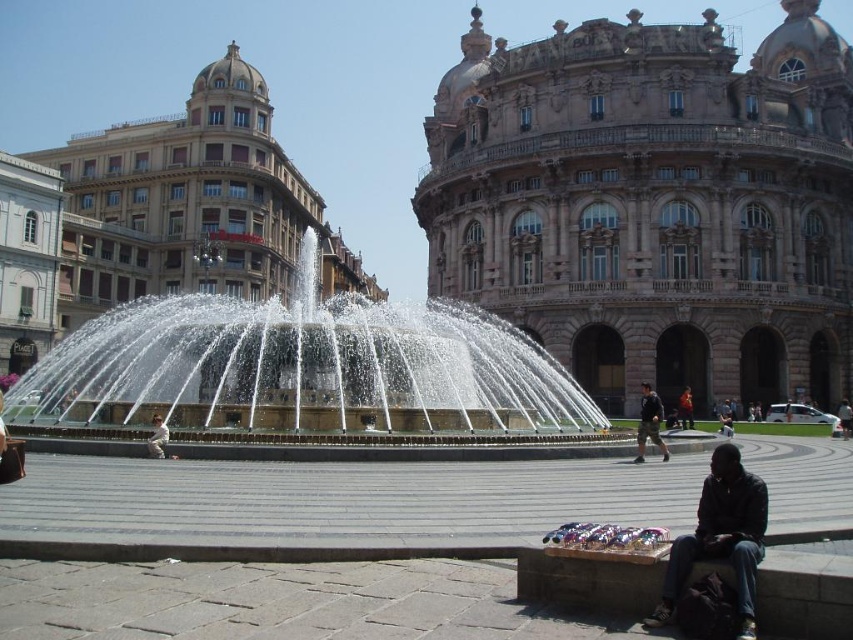
Does brown stone palace at upper center have a lesser height compared to white fabric person at center?

Incorrect, brown stone palace at upper center's height does not fall short of white fabric person at center's.

Who is more forward, (693, 26) or (154, 417)?

Point (154, 417) is more forward.

Who is more distant from viewer, (753, 225) or (149, 444)?

The point (753, 225) is behind.

You are a GUI agent. You are given a task and a screenshot of the screen. Output one action in this format:
    pyautogui.click(x=<x>, y=<y>)
    Task: Click on the brown stone palace at upper center
    This screenshot has height=640, width=853.
    Given the screenshot: What is the action you would take?
    pyautogui.click(x=653, y=204)

Is watermattefountain at center positioned behind dark brown leather jacket at center?

No.

What do you see at coordinates (300, 368) in the screenshot? The image size is (853, 640). I see `watermattefountain at center` at bounding box center [300, 368].

Find the location of a particular element. The image size is (853, 640). watermattefountain at center is located at coordinates (300, 368).

Between dark blue jeans at lower right and dark brown leather jacket at center, which one has less height?

dark brown leather jacket at center is shorter.

Can you confirm if dark blue jeans at lower right is smaller than dark brown leather jacket at center?

Incorrect, dark blue jeans at lower right is not smaller in size than dark brown leather jacket at center.

Which is in front, point (766, 524) or point (688, 419)?

Point (766, 524) is in front.

Locate an element on the screen. dark blue jeans at lower right is located at coordinates (721, 538).